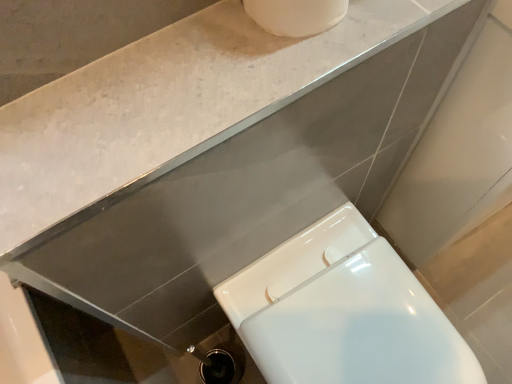
You are a GUI agent. You are given a task and a screenshot of the screen. Output one action in this format:
    pyautogui.click(x=<x>, y=<y>)
    Task: Click on the blank space situated above white glossy toilet at lower right (from a real-world perspective)
    The image size is (512, 384).
    Given the screenshot: What is the action you would take?
    pyautogui.click(x=351, y=324)